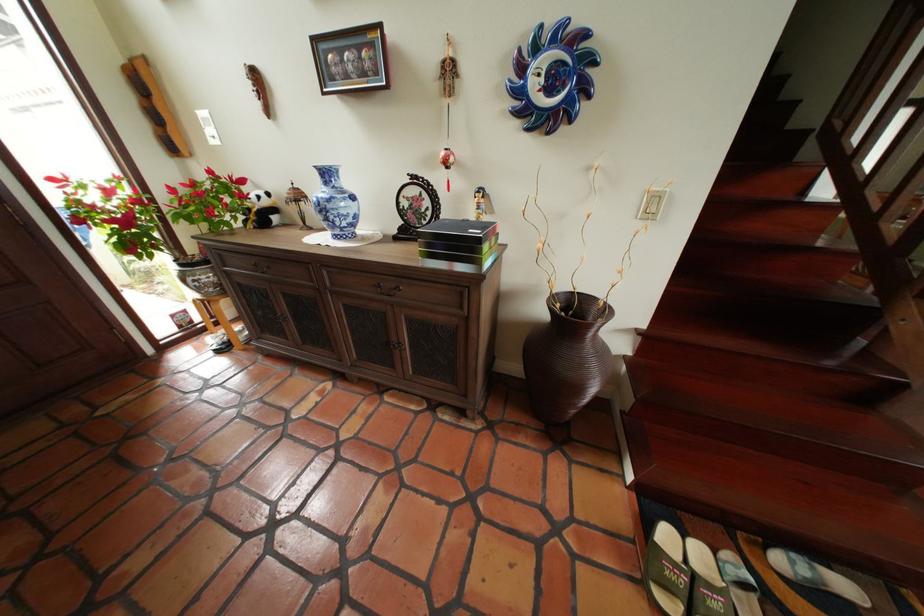
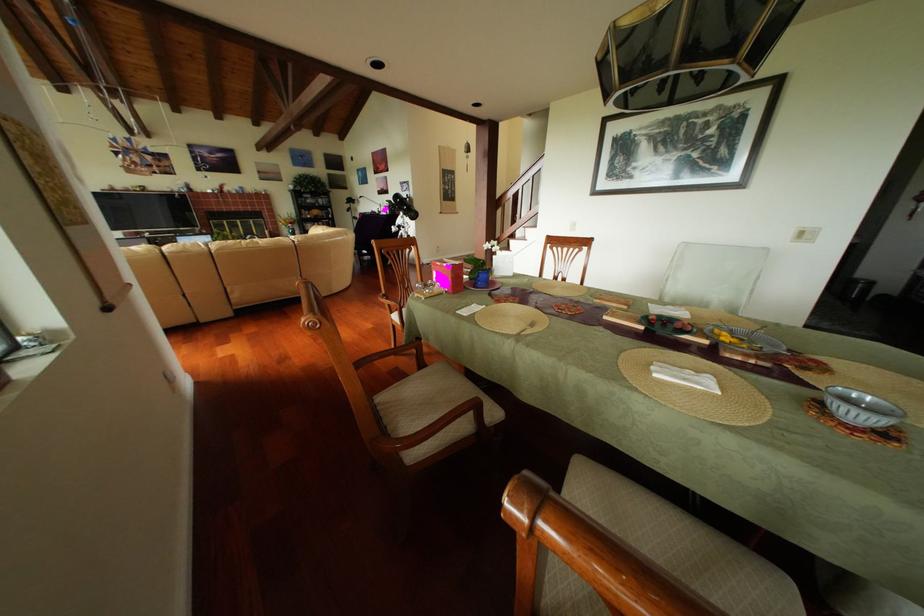
Question: I am providing you with two images of the same scene from different viewpoints. Please identify which objects are invisible in image2.

Choices:
 (A) white light switch
 (B) open white notebook
 (C) chair sitting surface
 (D) drawer handle

Answer: (D)